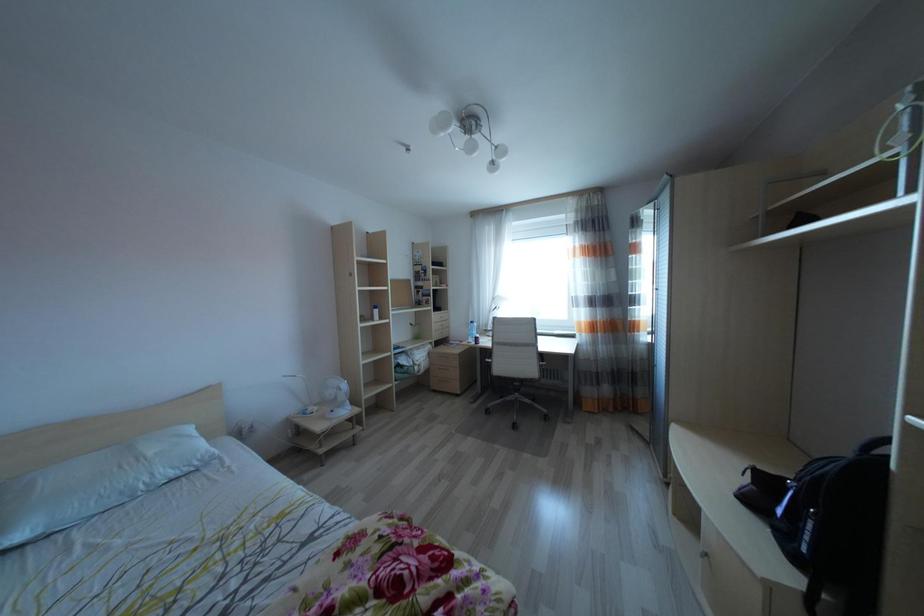
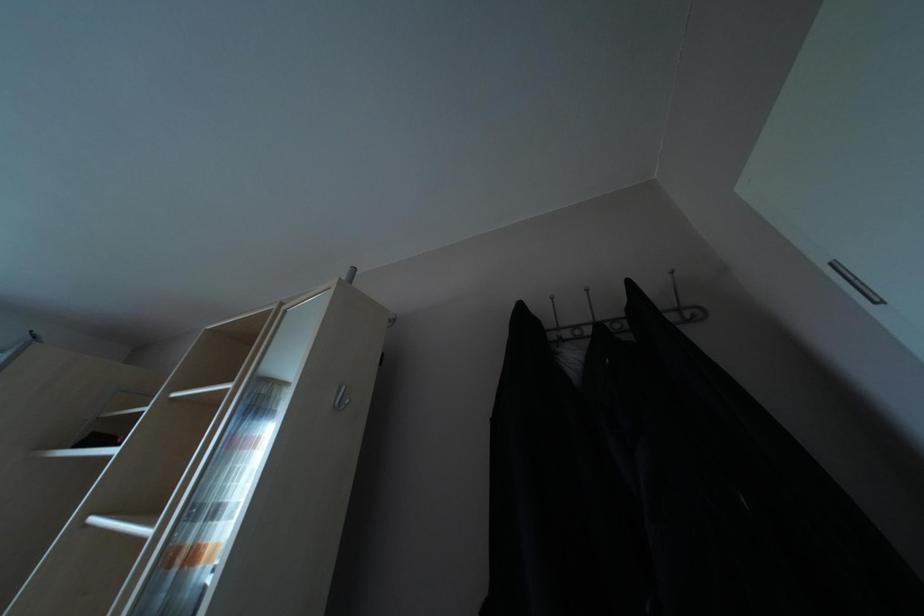
How did the camera likely rotate?

The camera's rotation is toward right-up.